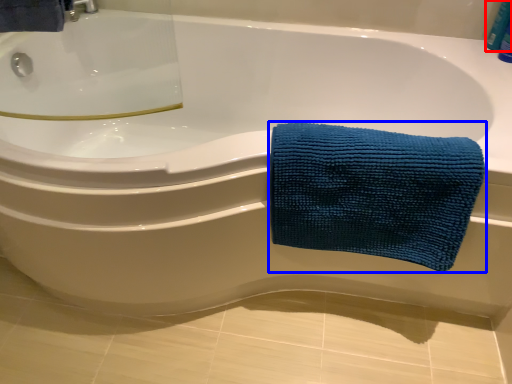
Question: Which point is closer to the camera, toiletry (highlighted by a red box) or towel (highlighted by a blue box)?

Choices:
 (A) toiletry
 (B) towel

Answer: (B)